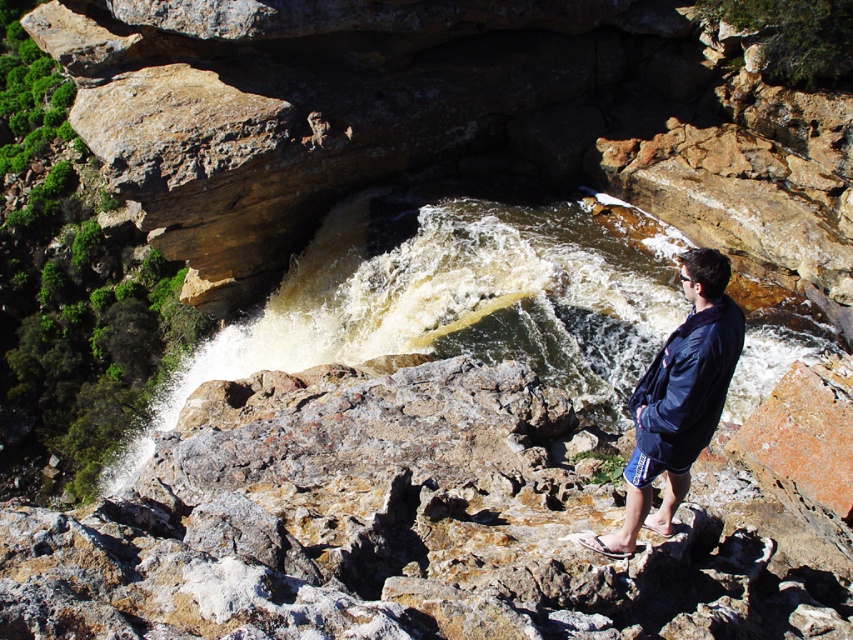
You are the person in the image standing on the rocky terrain overlooking the waterfall. You notice two points marked on the cliff face. Which point is closer to you, point 1 at coordinates point [670,528] or point 2 at coordinates point [596,536]?

Point 1 at coordinates point [670,528] is closer to you because it is further to the viewer than point 2 at coordinates point [596,536].